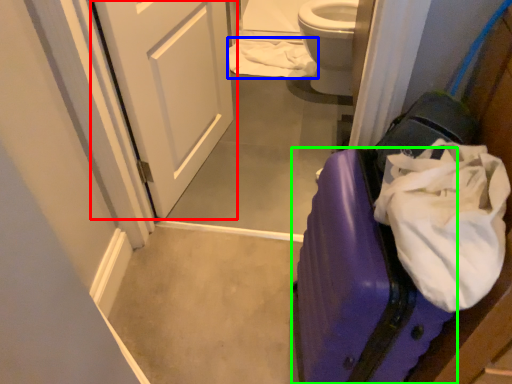
Question: Considering the real-world distances, which object is farthest from door (highlighted by a red box)? toilet paper (highlighted by a blue box) or suitcase (highlighted by a green box)?

Choices:
 (A) toilet paper
 (B) suitcase

Answer: (B)